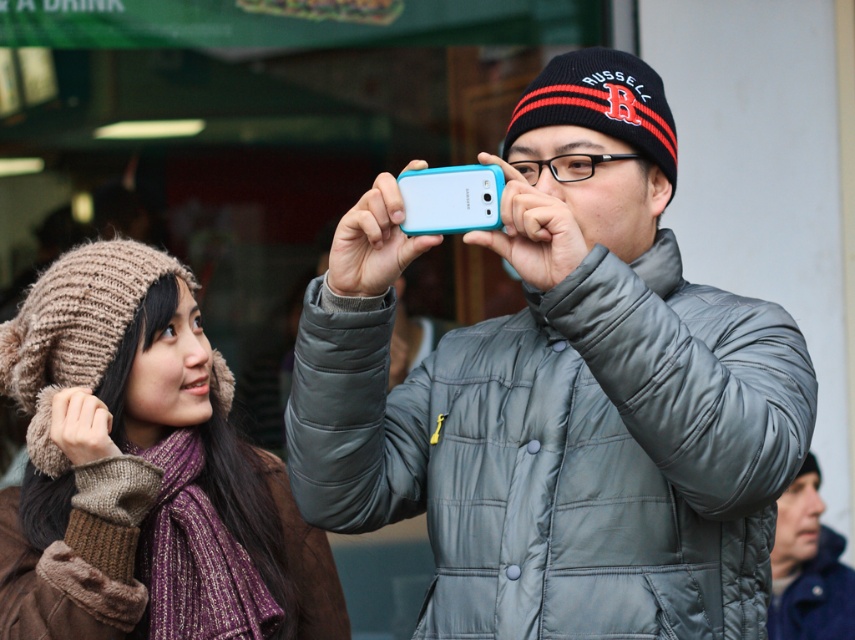
Question: Which point appears farthest from the camera in this image?

Choices:
 (A) (455, 214)
 (B) (22, 573)
 (C) (797, 625)

Answer: (C)

Question: Does teal matte phone at center have a smaller size compared to teal matte smartphone at center?

Choices:
 (A) no
 (B) yes

Answer: (A)

Question: Which object appears farthest from the camera in this image?

Choices:
 (A) knitted woolen hat at upper left
 (B) teal matte phone at center
 (C) teal matte smartphone at center
 (D) dark blue leather jacket at lower right

Answer: (D)

Question: Does dark blue leather jacket at lower right lie behind teal matte smartphone at center?

Choices:
 (A) yes
 (B) no

Answer: (A)

Question: Which point is closer to the camera taking this photo?

Choices:
 (A) click(x=506, y=442)
 (B) click(x=806, y=589)
 (C) click(x=458, y=172)

Answer: (C)

Question: Is teal matte phone at center to the left of dark blue leather jacket at lower right from the viewer's perspective?

Choices:
 (A) no
 (B) yes

Answer: (B)